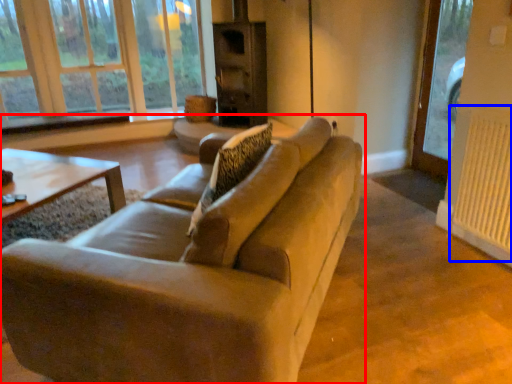
Question: Which point is closer to the camera, studio couch (highlighted by a red box) or radiator (highlighted by a blue box)?

Choices:
 (A) studio couch
 (B) radiator

Answer: (A)